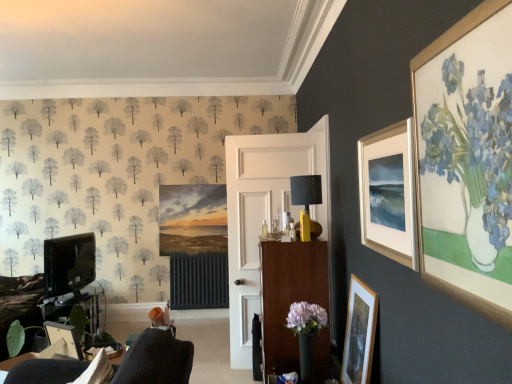
The width and height of the screenshot is (512, 384). What do you see at coordinates (269, 232) in the screenshot?
I see `wooden cabinet at center` at bounding box center [269, 232].

The height and width of the screenshot is (384, 512). I want to click on matte black tv at left, so click(x=70, y=277).

This screenshot has width=512, height=384. What do you see at coordinates (359, 333) in the screenshot? I see `matte black picture frame at lower right, acting as the 1th picture frame starting from the bottom` at bounding box center [359, 333].

Find the location of a particular element. The width and height of the screenshot is (512, 384). brown wood cabinet at center is located at coordinates (289, 296).

Locate an element on the screen. The image size is (512, 384). yellow matte lampshade at center is located at coordinates (307, 202).

Is brown wood cabinet at center directly adjacent to matte black tv at left?

brown wood cabinet at center and matte black tv at left are not in contact.

Considering the relative sizes of brown wood cabinet at center and matte black tv at left in the image provided, is brown wood cabinet at center bigger than matte black tv at left?

Yes, brown wood cabinet at center is bigger than matte black tv at left.

Which is more to the left, brown wood cabinet at center or matte black tv at left?

Positioned to the left is matte black tv at left.

Considering the sizes of brown wood cabinet at center and matte black tv at left in the image, is brown wood cabinet at center wider or thinner than matte black tv at left?

Clearly, brown wood cabinet at center has more width compared to matte black tv at left.

Is wooden cabinet at center to the right of brown wood cabinet at center from the viewer's perspective?

No.

Would you say wooden cabinet at center is a long distance from brown wood cabinet at center?

No, wooden cabinet at center is not far from brown wood cabinet at center.

From a real-world perspective, is wooden cabinet at center physically above brown wood cabinet at center?

Yes, from a real-world perspective, wooden cabinet at center is above brown wood cabinet at center.

Do you think wooden cabinet at center is within brown wood cabinet at center, or outside of it?

wooden cabinet at center exists outside the volume of brown wood cabinet at center.

Is wooden picture frame at lower left, the 3th picture frame positioned from the right, positioned with its back to matte black picture frame at lower right, placed as the second picture frame when sorted from right to left?

No, wooden picture frame at lower left, the 3th picture frame positioned from the right, is not facing away from matte black picture frame at lower right, placed as the second picture frame when sorted from right to left.

From their relative heights in the image, would you say wooden picture frame at lower left, the first picture frame positioned from the left, is taller or shorter than matte black picture frame at lower right, marked as the 3th picture frame in a top-to-bottom arrangement?

Considering their sizes, wooden picture frame at lower left, the first picture frame positioned from the left, has less height than matte black picture frame at lower right, marked as the 3th picture frame in a top-to-bottom arrangement.

Looking at this image, is wooden picture frame at lower left, the 3th picture frame positioned from the right, not close to matte black picture frame at lower right, the second picture frame when ordered from left to right?

Yes, wooden picture frame at lower left, the 3th picture frame positioned from the right, is far from matte black picture frame at lower right, the second picture frame when ordered from left to right.

Which is nearer, (79, 349) or (355, 382)?

Point (79, 349) is positioned farther from the camera compared to point (355, 382).

Considering the positions of points (246, 179) and (319, 176), is point (246, 179) farther from camera compared to point (319, 176)?

Yes, point (246, 179) is behind point (319, 176).

Are wooden cabinet at center and yellow matte lampshade at center making contact?

No, wooden cabinet at center is not beside yellow matte lampshade at center.

The image size is (512, 384). Find the location of `lamp above the wooden cabinet at center (from a real-world perspective)`. lamp above the wooden cabinet at center (from a real-world perspective) is located at coordinates (307, 202).

Can you confirm if wooden cabinet at center is taller than matte black picture frame at lower right, the second picture frame when ordered from left to right?

Yes.

Between point (234, 223) and point (351, 337), which one is positioned behind?

Point (234, 223)

From the image's perspective, which object appears higher, wooden cabinet at center or matte black picture frame at lower right, acting as the 1th picture frame starting from the bottom?

From the image's view, wooden cabinet at center is above.

Does wooden cabinet at center appear on the right side of matte black picture frame at lower right, marked as the 3th picture frame in a top-to-bottom arrangement?

No, wooden cabinet at center is not to the right of matte black picture frame at lower right, marked as the 3th picture frame in a top-to-bottom arrangement.

Considering the positions of objects matte black picture frame at lower right, the second picture frame when ordered from left to right, and yellow matte lampshade at center in the image provided, who is more to the right, matte black picture frame at lower right, the second picture frame when ordered from left to right, or yellow matte lampshade at center?

matte black picture frame at lower right, the second picture frame when ordered from left to right.

Looking at this image, are matte black picture frame at lower right, acting as the 1th picture frame starting from the bottom, and yellow matte lampshade at center beside each other?

No.

Is matte black picture frame at lower right, placed as the second picture frame when sorted from right to left, oriented towards yellow matte lampshade at center?

No, matte black picture frame at lower right, placed as the second picture frame when sorted from right to left, is not oriented towards yellow matte lampshade at center.

Is wooden picture frame at lower left, the first picture frame positioned from the left, at the back of wooden cabinet at center?

wooden cabinet at center does not have its back to wooden picture frame at lower left, the first picture frame positioned from the left.

Which point is more distant from viewer, (302, 298) or (73, 352)?

The point (302, 298) is more distant.

Would you say wooden cabinet at center is to the left or to the right of wooden picture frame at lower left, the 2th picture frame positioned from the top, in the picture?

Clearly, wooden cabinet at center is on the right of wooden picture frame at lower left, the 2th picture frame positioned from the top, in the image.

The image size is (512, 384). In order to click on entertainment center above the brown wood cabinet at center (from a real-world perspective) in this screenshot , I will do `click(70, 277)`.

Identify the location of furniture on the right of wooden cabinet at center. This screenshot has width=512, height=384. (289, 296).

Which object lies further to the anchor point brown wood cabinet at center, yellow matte lampshade at center or wooden picture frame at lower left, the first picture frame positioned from the left?

Among the two, wooden picture frame at lower left, the first picture frame positioned from the left, is located further to brown wood cabinet at center.

Considering their positions, is brown wood cabinet at center positioned further to yellow matte lampshade at center than wooden cabinet at center?

Among the two, wooden cabinet at center is located further to yellow matte lampshade at center.

When comparing their distances from wooden picture frame at lower left, which ranks as the 2th picture frame in bottom-to-top order, does brown wood cabinet at center or matte white picture frame at upper right, placed as the 1th picture frame when sorted from top to bottom, seem closer?

brown wood cabinet at center.

Looking at the image, which one is located further to matte black tv at left, matte black picture frame at lower right, placed as the second picture frame when sorted from right to left, or brown wood cabinet at center?

Among the two, matte black picture frame at lower right, placed as the second picture frame when sorted from right to left, is located further to matte black tv at left.

From the image, which object appears to be farther from matte white picture frame at upper right, placed as the 1th picture frame when sorted from top to bottom, wooden picture frame at lower left, the 2th picture frame positioned from the top, or yellow matte lampshade at center?

wooden picture frame at lower left, the 2th picture frame positioned from the top, is positioned further to the anchor matte white picture frame at upper right, placed as the 1th picture frame when sorted from top to bottom.

Looking at the image, which one is located further to wooden cabinet at center, matte black tv at left or yellow matte lampshade at center?

matte black tv at left is positioned further to the anchor wooden cabinet at center.

When comparing their distances from brown wood cabinet at center, does wooden picture frame at lower left, the first picture frame positioned from the left, or matte black picture frame at lower right, the second picture frame when ordered from left to right, seem closer?

matte black picture frame at lower right, the second picture frame when ordered from left to right, is closer to brown wood cabinet at center.

From the picture: Based on their spatial positions, is brown wood cabinet at center or wooden cabinet at center further from matte black tv at left?

The object further to matte black tv at left is brown wood cabinet at center.

Locate an element on the screen. The image size is (512, 384). furniture located between matte white picture frame at upper right, the 3th picture frame ordered from the bottom, and yellow matte lampshade at center in the depth direction is located at coordinates (289, 296).

You are a GUI agent. You are given a task and a screenshot of the screen. Output one action in this format:
    pyautogui.click(x=<x>, y=<y>)
    Task: Click on the side situated between matte black tv at left and yellow matte lampshade at center from left to right
    
    Given the screenshot: What is the action you would take?
    pyautogui.click(x=269, y=232)

The image size is (512, 384). In order to click on side located between matte black tv at left and matte black picture frame at lower right, placed as the second picture frame when sorted from right to left, in the left-right direction in this screenshot , I will do `click(269, 232)`.

Where is `furniture between wooden picture frame at lower left, the 3th picture frame positioned from the right, and yellow matte lampshade at center`? furniture between wooden picture frame at lower left, the 3th picture frame positioned from the right, and yellow matte lampshade at center is located at coordinates (289, 296).